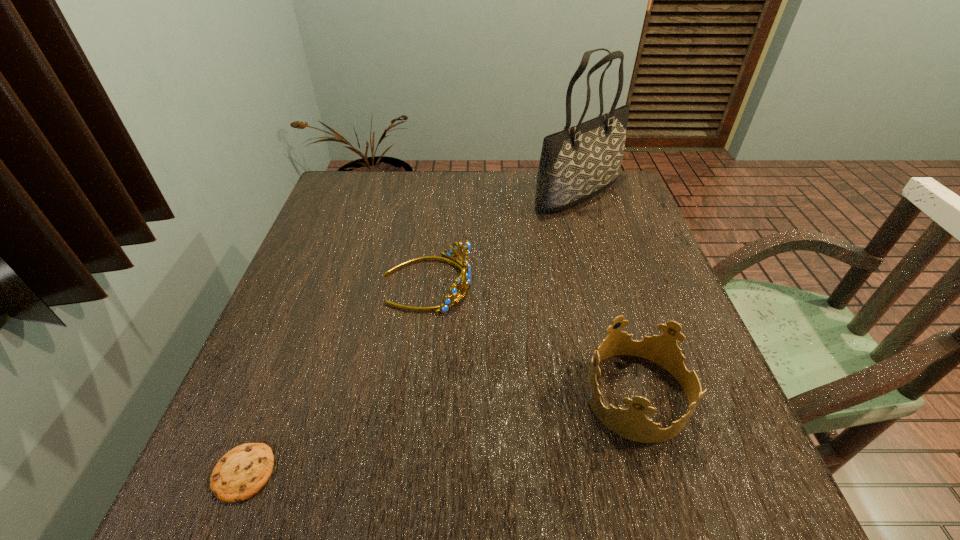
Where is `empty space between the second farthest object and the cookie`? The image size is (960, 540). empty space between the second farthest object and the cookie is located at coordinates (335, 378).

Where is `free point between the nearer tiara and the leftmost object`? free point between the nearer tiara and the leftmost object is located at coordinates (441, 434).

At what (x,y) coordinates should I click in order to perform the action: click on unoccupied area between the right tiara and the tote bag. Please return your answer as a coordinate pair (x, y). The width and height of the screenshot is (960, 540). Looking at the image, I should click on (608, 294).

Where is `free space between the tallest object and the farther tiara`? The width and height of the screenshot is (960, 540). free space between the tallest object and the farther tiara is located at coordinates (502, 238).

This screenshot has height=540, width=960. In order to click on free space between the shortest object and the tallest object in this screenshot , I will do `click(410, 333)`.

Find the location of `vacant area that lies between the right tiara and the farther tiara`. vacant area that lies between the right tiara and the farther tiara is located at coordinates (532, 339).

Identify the location of empty space that is in between the third farthest object and the cookie. The image size is (960, 540). (441, 434).

Find the location of a particular element. The width and height of the screenshot is (960, 540). unoccupied area between the right tiara and the leftmost object is located at coordinates (441, 434).

What are the coordinates of `the closest object to the leftmost object` in the screenshot? It's located at (464, 267).

The height and width of the screenshot is (540, 960). Find the location of `the third closest object to the left tiara`. the third closest object to the left tiara is located at coordinates (242, 472).